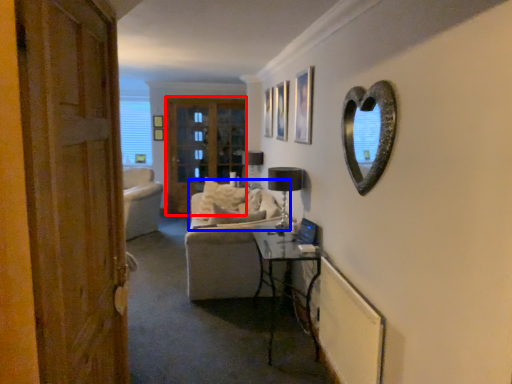
Question: Among these objects, which one is nearest to the camera, screen door (highlighted by a red box) or couch (highlighted by a blue box)?

Choices:
 (A) screen door
 (B) couch

Answer: (B)